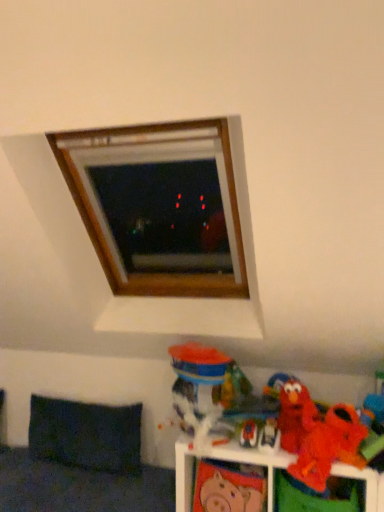
Question: Is red plush toy at lower right, the 3th toy from the right, positioned far away from matte plastic elmo at lower right, marked as the 4th toy in a right-to-left arrangement?

Choices:
 (A) yes
 (B) no

Answer: (B)

Question: Is red plush toy at lower right, arranged as the 5th toy when viewed from the left, facing away from matte plastic elmo at lower right, marked as the 4th toy in a right-to-left arrangement?

Choices:
 (A) yes
 (B) no

Answer: (B)

Question: From the image's perspective, is red plush toy at lower right, arranged as the 5th toy when viewed from the left, located beneath matte plastic elmo at lower right, marked as the 4th toy in a right-to-left arrangement?

Choices:
 (A) yes
 (B) no

Answer: (B)

Question: Can you confirm if red plush toy at lower right, the 3th toy from the right, is bigger than matte plastic elmo at lower right, the fourth toy positioned from the left?

Choices:
 (A) no
 (B) yes

Answer: (B)

Question: From a real-world perspective, is red plush toy at lower right, arranged as the 5th toy when viewed from the left, below matte plastic elmo at lower right, the fourth toy positioned from the left?

Choices:
 (A) yes
 (B) no

Answer: (B)

Question: Does red plush toy at lower right, the 3th toy from the right, touch matte plastic elmo at lower right, marked as the 4th toy in a right-to-left arrangement?

Choices:
 (A) yes
 (B) no

Answer: (B)

Question: Is orange plush toy at lower right far away from dark fabric pillow at lower left?

Choices:
 (A) no
 (B) yes

Answer: (A)

Question: Can you confirm if orange plush toy at lower right is wider than dark fabric pillow at lower left?

Choices:
 (A) no
 (B) yes

Answer: (B)

Question: Would you say orange plush toy at lower right contains dark fabric pillow at lower left?

Choices:
 (A) yes
 (B) no

Answer: (B)

Question: Can you confirm if orange plush toy at lower right is positioned to the left of dark fabric pillow at lower left?

Choices:
 (A) yes
 (B) no

Answer: (B)

Question: From a real-world perspective, is orange plush toy at lower right on top of dark fabric pillow at lower left?

Choices:
 (A) yes
 (B) no

Answer: (B)

Question: Is orange plush toy at lower right to the right of dark fabric pillow at lower left from the viewer's perspective?

Choices:
 (A) no
 (B) yes

Answer: (B)

Question: Can you confirm if orange plush toy at lower right, marked as the 1th toy in a right-to-left arrangement, is positioned to the right of matte pink piggy bank at lower center, the sixth toy in the right-to-left sequence?

Choices:
 (A) yes
 (B) no

Answer: (A)